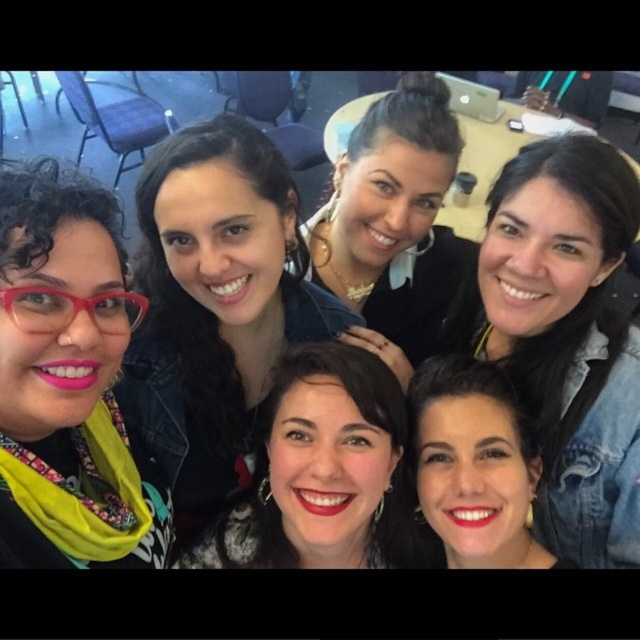
Question: Is yellow fabric scarf at left above matte black jacket at upper center?

Choices:
 (A) no
 (B) yes

Answer: (A)

Question: Can you confirm if matte black hair at center is positioned to the left of smooth skin at center?

Choices:
 (A) no
 (B) yes

Answer: (B)

Question: Which of the following is the closest to the observer?

Choices:
 (A) (332, 548)
 (B) (458, 140)
 (C) (516, 314)

Answer: (A)

Question: Can you confirm if matte black jacket at upper center is positioned above smooth skin at center?

Choices:
 (A) no
 (B) yes

Answer: (B)

Question: Among these points, which one is farthest from the camera?

Choices:
 (A) (516, 506)
 (B) (58, 186)
 (C) (518, 330)
 (D) (426, 321)

Answer: (D)

Question: Which point appears farthest from the camera in this image?

Choices:
 (A) (51, 413)
 (B) (426, 449)

Answer: (B)